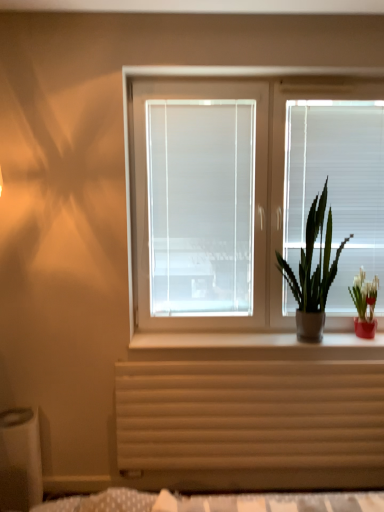
Question: Is white matte blind at right wider or thinner than wooden radiator at lower center?

Choices:
 (A) wide
 (B) thin

Answer: (B)

Question: From the image's perspective, is white matte blind at right above or below wooden radiator at lower center?

Choices:
 (A) above
 (B) below

Answer: (A)

Question: Which is nearer to the white matte window sill at center?

Choices:
 (A) white matte blind at right
 (B) wooden radiator at lower center
 (C) green matte plant at right, which is the first houseplant from left to right
 (D) white matte window box at lower left
 (E) green leafy plant at right, arranged as the 1th houseplant when viewed from the right

Answer: (B)

Question: Which object is the farthest from the white matte window at center?

Choices:
 (A) white matte window screen at center
 (B) white matte window box at lower left
 (C) white matte window sill at center
 (D) green leafy plant at right, arranged as the 1th houseplant when viewed from the right
 (E) wooden radiator at lower center

Answer: (B)